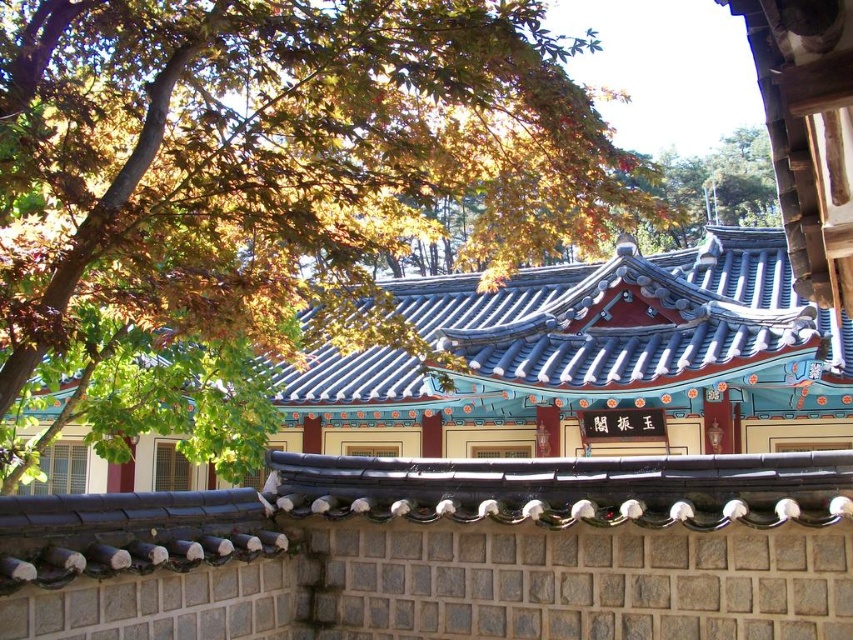
Question: Which point is farther to the camera?

Choices:
 (A) blue glazed tile roof at center
 (B) green leafy tree at upper left

Answer: (B)

Question: Is blue glazed tile roof at center below green leafy tree at upper left?

Choices:
 (A) yes
 (B) no

Answer: (A)

Question: Does blue glazed tile roof at center have a larger size compared to green leafy tree at upper left?

Choices:
 (A) yes
 (B) no

Answer: (B)

Question: Where is blue glazed tile roof at center located in relation to green leafy tree at upper left in the image?

Choices:
 (A) left
 (B) right

Answer: (A)

Question: Which point is farther to the camera?

Choices:
 (A) blue glazed tile roof at center
 (B) green leafy tree at upper left

Answer: (B)

Question: Which point is farther to the camera?

Choices:
 (A) green leafy tree at upper left
 (B) blue glazed tile roof at center

Answer: (A)